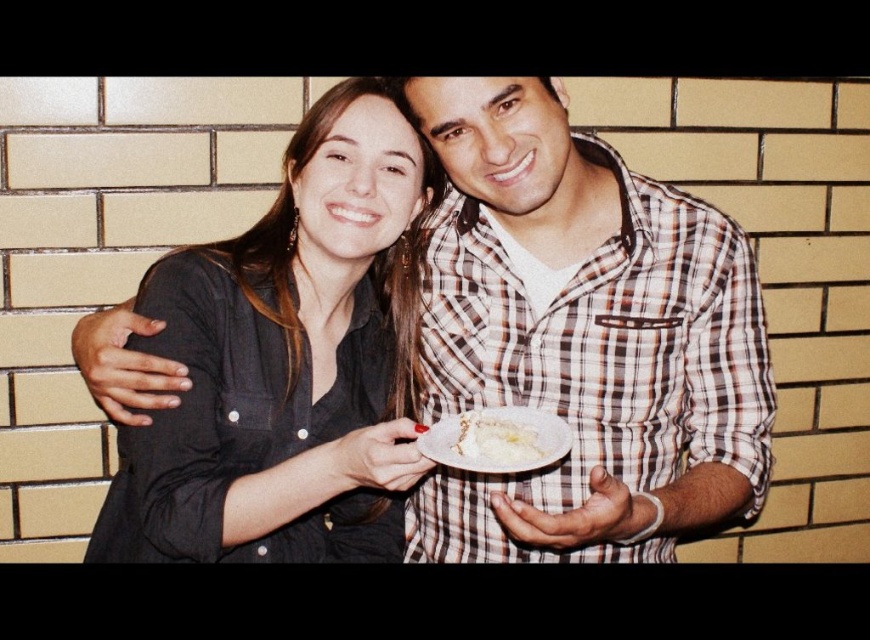
Looking at this image, does checkered fabric shirt at center have a smaller size compared to matte black shirt at center?

No.

Where is `checkered fabric shirt at center`? Image resolution: width=870 pixels, height=640 pixels. checkered fabric shirt at center is located at coordinates (583, 337).

Is point (174, 420) less distant than point (514, 420)?

That is False.

Between matte black shirt at center and white creamy cake at center, which one has more height?

matte black shirt at center is taller.

Does point (318, 180) come farther from viewer compared to point (494, 426)?

Yes, point (318, 180) is behind point (494, 426).

I want to click on matte black shirt at center, so click(x=286, y=360).

Is checkered fabric shirt at center to the right of white creamy cake at center from the viewer's perspective?

Correct, you'll find checkered fabric shirt at center to the right of white creamy cake at center.

Is checkered fabric shirt at center bigger than white creamy cake at center?

Yes.

Which is behind, point (544, 288) or point (529, 413)?

The point (544, 288) is behind.

You are a GUI agent. You are given a task and a screenshot of the screen. Output one action in this format:
    pyautogui.click(x=<x>, y=<y>)
    Task: Click on the checkered fabric shirt at center
    
    Given the screenshot: What is the action you would take?
    pyautogui.click(x=583, y=337)